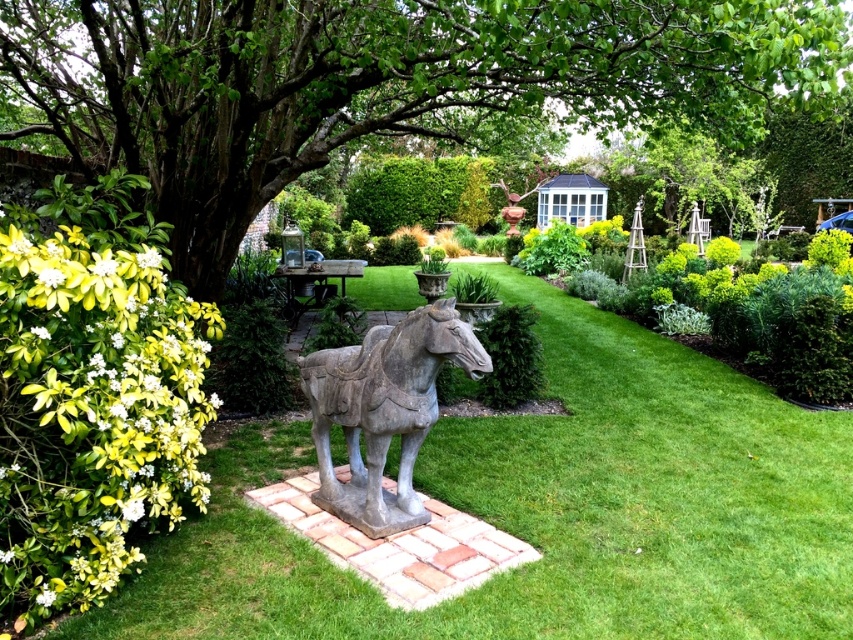
Question: Is green grass at center smaller than green leafy tree at upper left?

Choices:
 (A) no
 (B) yes

Answer: (B)

Question: Can you confirm if green leafy tree at upper left is positioned to the left of gray stone horse at center?

Choices:
 (A) yes
 (B) no

Answer: (A)

Question: Among these objects, which one is nearest to the camera?

Choices:
 (A) green grass at center
 (B) green leafy tree at upper left
 (C) gray stone horse at center

Answer: (C)

Question: Which object is farther from the camera taking this photo?

Choices:
 (A) gray stone horse at center
 (B) green grass at center
 (C) green leafy tree at upper left

Answer: (B)

Question: Does green grass at center come in front of green leafy tree at upper left?

Choices:
 (A) yes
 (B) no

Answer: (B)

Question: Which object is positioned closest to the gray stone horse at center?

Choices:
 (A) green grass at center
 (B) green leafy tree at upper left

Answer: (B)